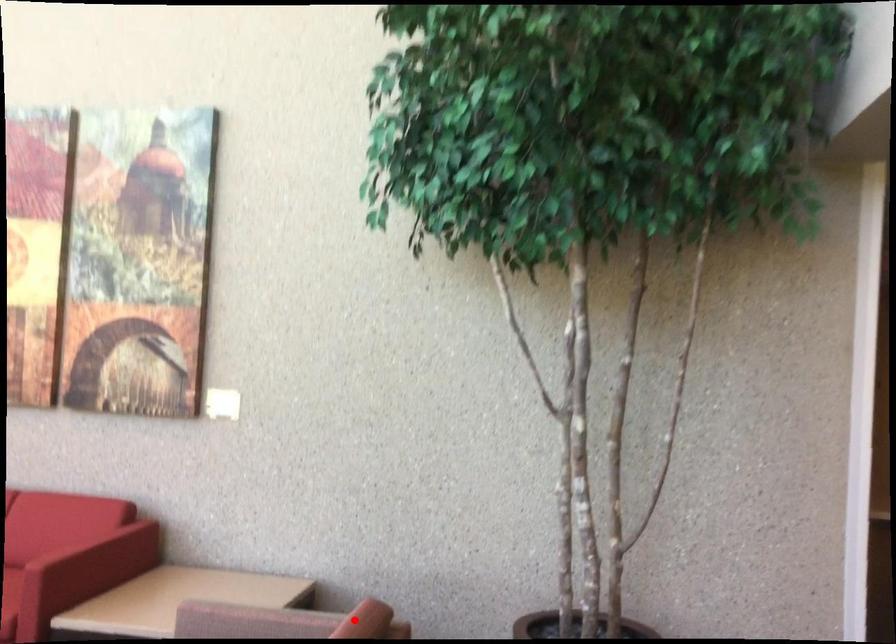
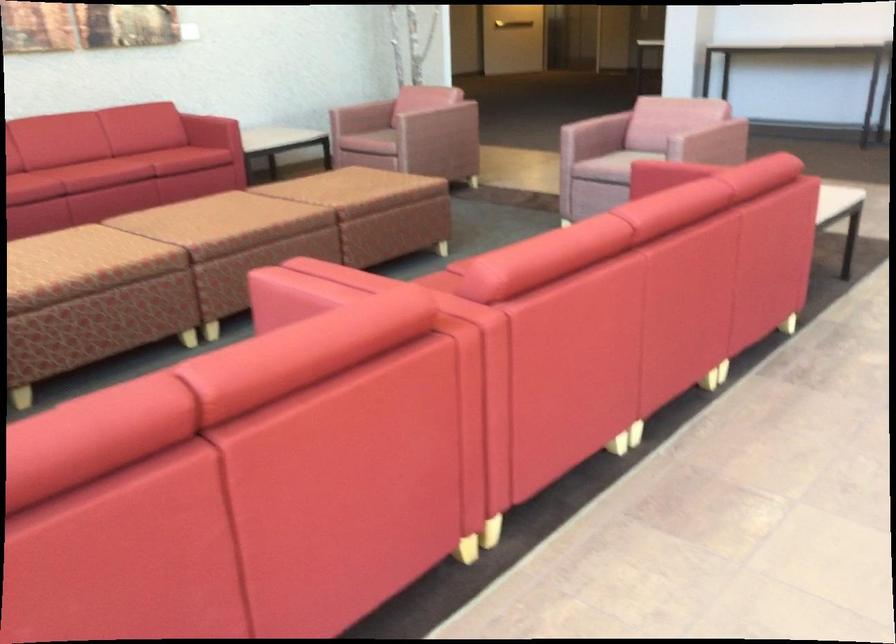
Locate, in the second image, the point that corresponds to the highlighted location in the first image.

(428, 80)